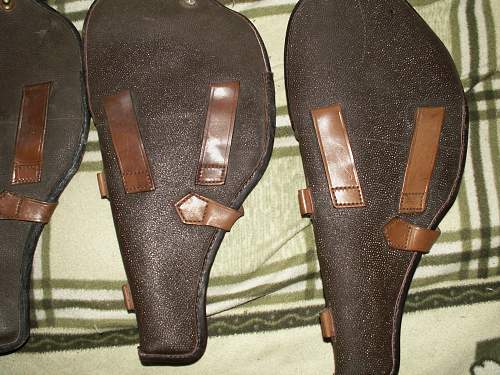
At what (x,y) coordinates should I click in order to perform the action: click on fabric covering. Please return your answer as a coordinate pair (x, y). The height and width of the screenshot is (375, 500). Looking at the image, I should click on (272, 284).